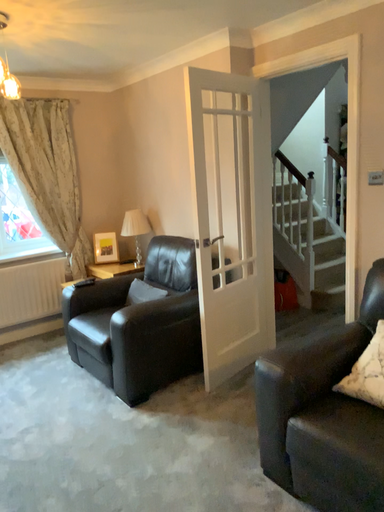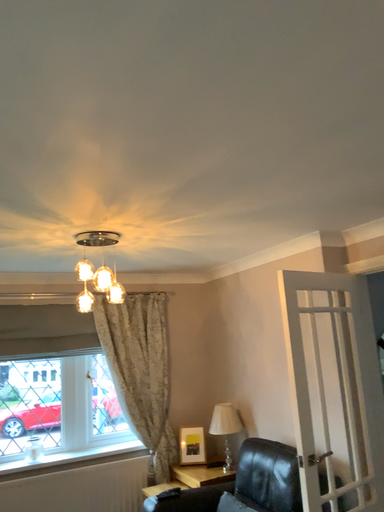
Question: How did the camera likely rotate when shooting the video?

Choices:
 (A) rotated right
 (B) rotated left

Answer: (B)